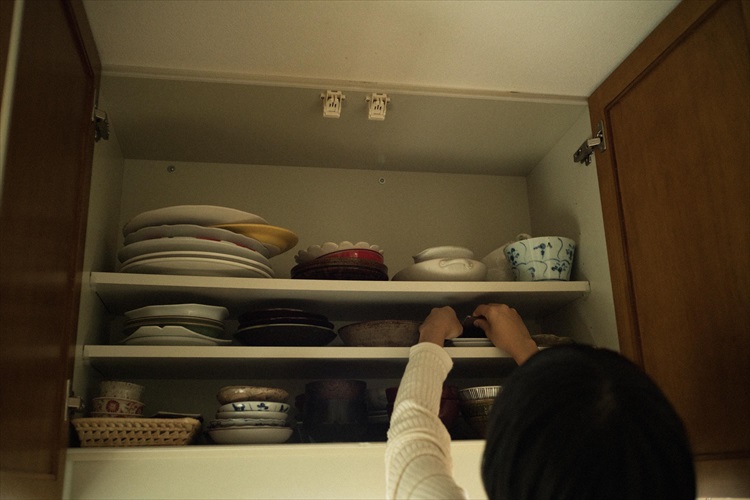
Where is `shelves`? Image resolution: width=750 pixels, height=500 pixels. shelves is located at coordinates (308, 351), (321, 289).